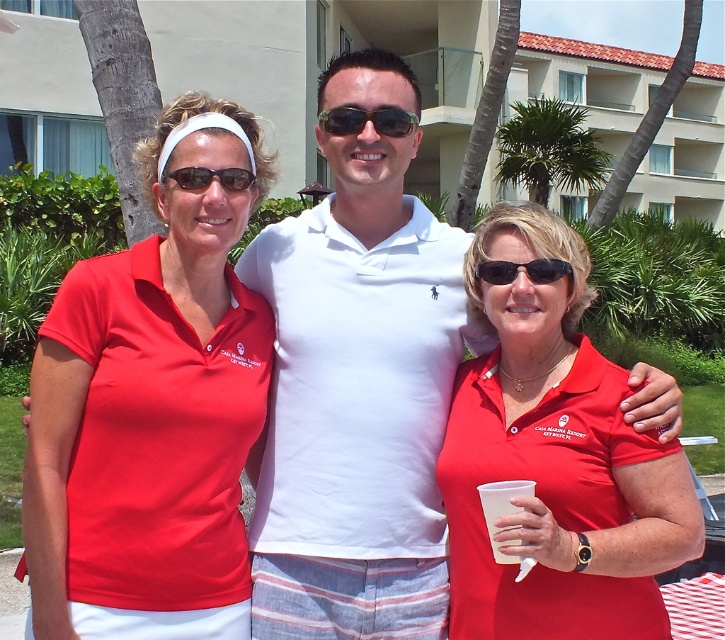
You are a photographer taking a picture of the green leafy palm tree at upper center and the black plastic sunglasses at center. Which object is taller in the image?

The green leafy palm tree at upper center is taller than the black plastic sunglasses at center.

You are a photographer trying to capture a clear shot of the black plastic sunglasses at center and the matte black sunglasses at center. Which pair of sunglasses is blocking the view of the other?

The black plastic sunglasses at center is in front of the matte black sunglasses at center, so it is blocking the view of the matte black sunglasses at center.